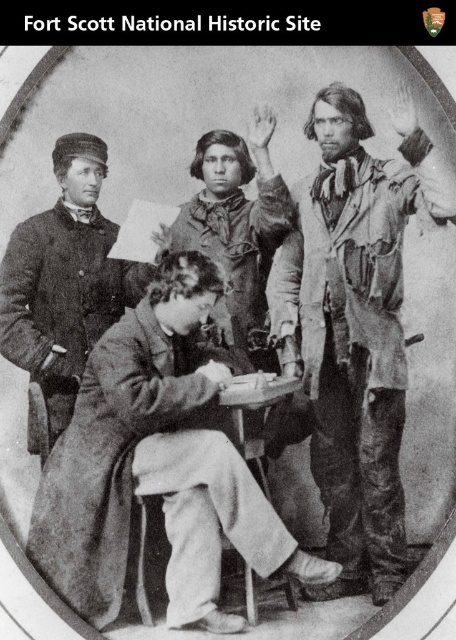
Question: Does ragged fabric shirt at right have a smaller size compared to worn fabric shirt at center?

Choices:
 (A) yes
 (B) no

Answer: (B)

Question: Is the position of ragged fabric shirt at right more distant than that of worn fabric shirt at center?

Choices:
 (A) yes
 (B) no

Answer: (B)

Question: Which point is closer to the camera?

Choices:
 (A) ragged fabric shirt at right
 (B) coarse woolen coat at center
 (C) worn fabric shirt at center
 (D) smooth leather jacket at center

Answer: (B)

Question: Which object is positioned closest to the ragged fabric shirt at right?

Choices:
 (A) smooth leather jacket at center
 (B) worn fabric shirt at center

Answer: (B)

Question: Can you confirm if ragged fabric shirt at right is thinner than worn fabric shirt at center?

Choices:
 (A) no
 (B) yes

Answer: (A)

Question: Among these points, which one is farthest from the camera?

Choices:
 (A) (414, 188)
 (B) (25, 227)
 (C) (264, 291)

Answer: (C)